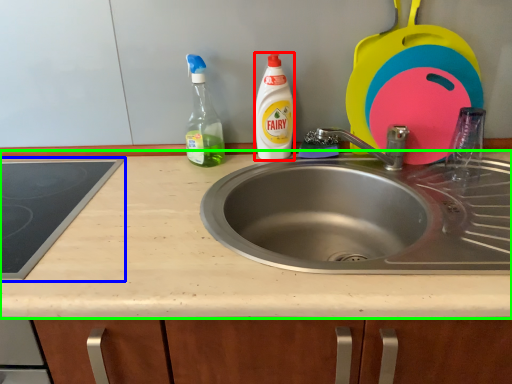
Question: Which object is the closest to the cleaning product (highlighted by a red box)? Choose among these: gas stove (highlighted by a blue box) or countertop (highlighted by a green box).

Choices:
 (A) gas stove
 (B) countertop

Answer: (B)